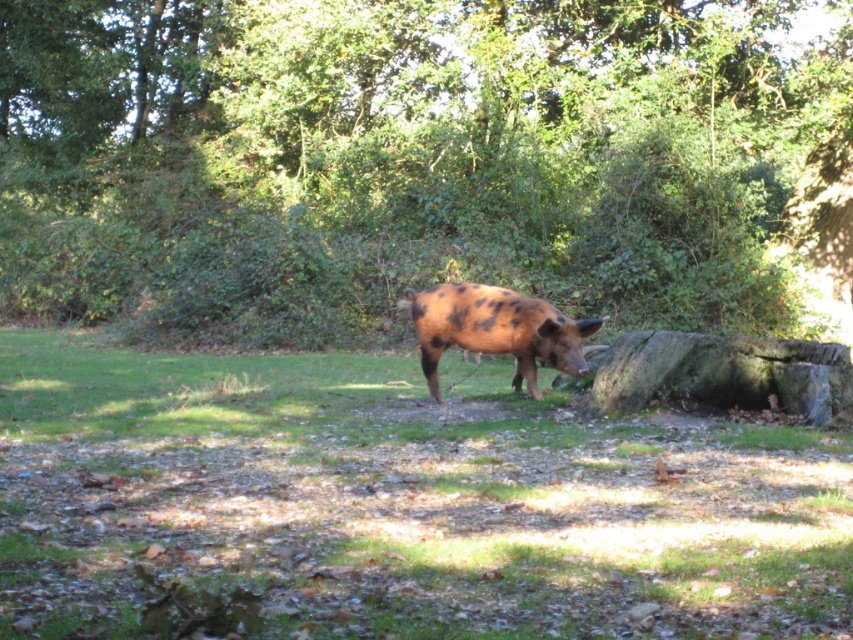
You are a photographer aiming to capture the spotted brown pig at center and the green leafy tree at center in a single shot. Based on their positions, will the pig be visible in front of the tree or behind it?

The spotted brown pig at center is behind the green leafy tree at center, so the pig will be visible behind the tree in the photo.

You are a gardener planning to plant a new tree in the space between the green leafy tree at center and the brown grassy at center. Based on the current spacing between them, do you think there is enough room for the new tree?

The green leafy tree at center might be wider than brown grassy at center, so there may not be enough space for the new tree. Check the exact dimensions before planting.